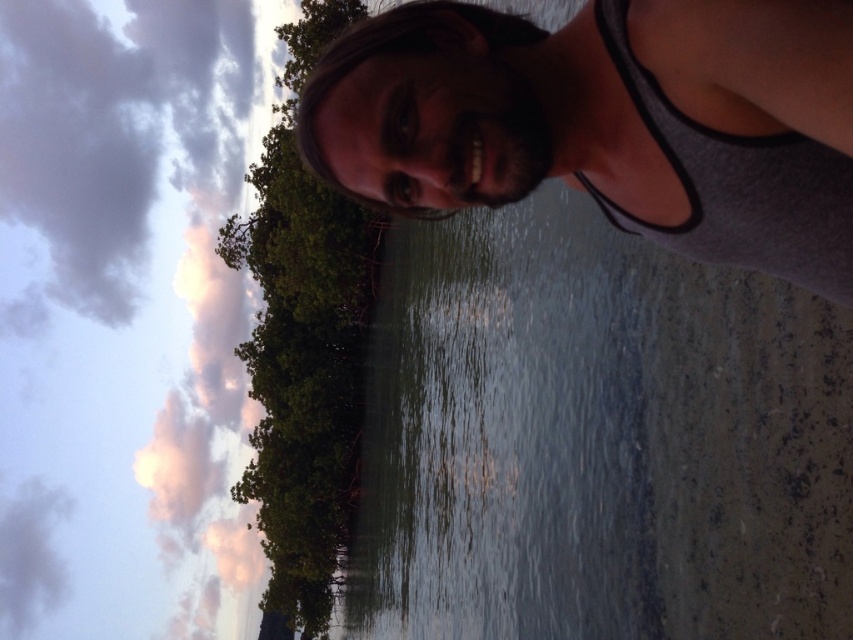
Question: Can you confirm if pink fluffy cloud at upper left is positioned above gray fabric tank top at upper center?

Choices:
 (A) no
 (B) yes

Answer: (A)

Question: Which point is farther from the camera taking this photo?

Choices:
 (A) (291, 624)
 (B) (175, 205)

Answer: (B)

Question: Estimate the real-world distances between objects in this image. Which object is farther from the pink fluffy cloud at upper left?

Choices:
 (A) green leafy tree at center
 (B) gray fabric tank top at upper center

Answer: (B)

Question: Does pink fluffy cloud at upper left have a larger size compared to green leafy tree at center?

Choices:
 (A) no
 (B) yes

Answer: (B)

Question: Does pink fluffy cloud at upper left appear under gray fabric tank top at upper center?

Choices:
 (A) yes
 (B) no

Answer: (A)

Question: Which point is farther to the camera?

Choices:
 (A) (204, 109)
 (B) (334, 333)

Answer: (A)